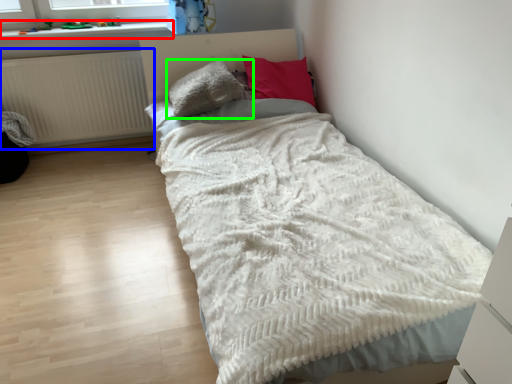
Question: Considering the real-world distances, which object is closest to window sill (highlighted by a red box)? radiator (highlighted by a blue box) or pillow (highlighted by a green box).

Choices:
 (A) radiator
 (B) pillow

Answer: (A)